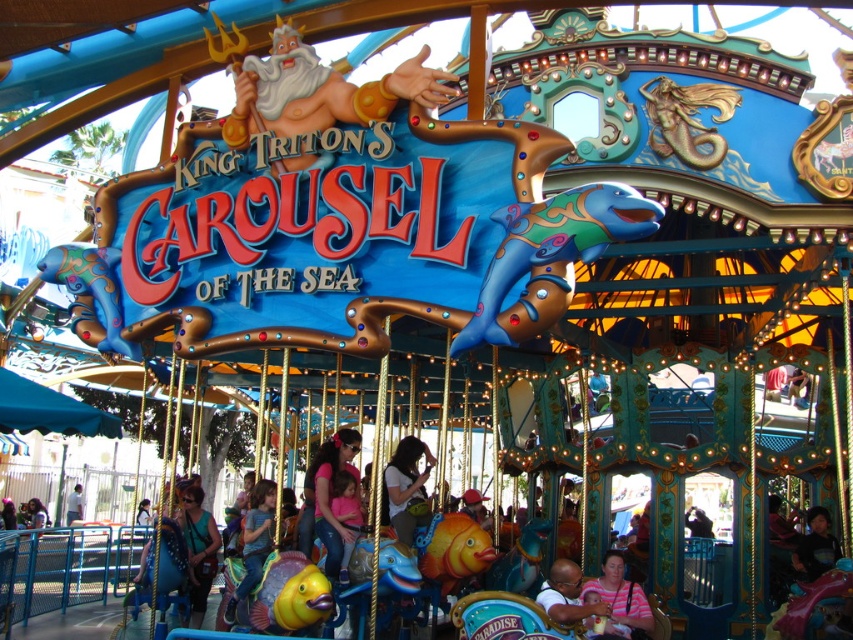
Question: Can you confirm if matte blue shirt at lower center is thinner than striped fabric baby at lower right?

Choices:
 (A) no
 (B) yes

Answer: (B)

Question: Among these points, which one is farthest from the camera?

Choices:
 (A) (241, 596)
 (B) (347, 502)
 (C) (190, 538)

Answer: (C)

Question: Is matte yellow fish at center to the left of matte black helmet at lower right from the viewer's perspective?

Choices:
 (A) no
 (B) yes

Answer: (B)

Question: Does pink fabric at center have a larger size compared to matte pink shirt at center?

Choices:
 (A) yes
 (B) no

Answer: (A)

Question: Among these points, which one is nearest to the camera?

Choices:
 (A) (201, 547)
 (B) (247, 518)
 (C) (630, 602)

Answer: (C)

Question: Which of the following is the closest to the observer?

Choices:
 (A) (332, 500)
 (B) (322, 497)
 (C) (409, 461)
 (D) (253, 582)

Answer: (D)